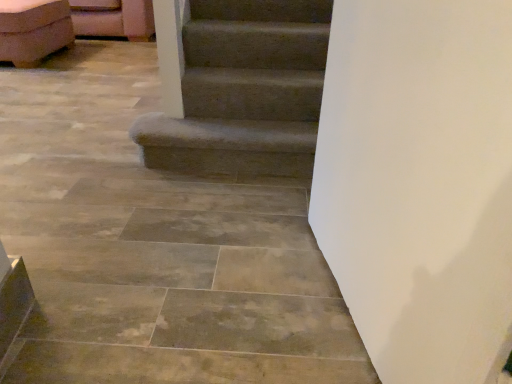
Measure the distance between velvet brown sofa at upper left and camera.

velvet brown sofa at upper left is 2.98 meters from camera.

The width and height of the screenshot is (512, 384). Describe the element at coordinates (33, 30) in the screenshot. I see `velvet brown sofa at upper left` at that location.

Locate an element on the screen. The width and height of the screenshot is (512, 384). velvet brown sofa at upper left is located at coordinates (33, 30).

Locate an element on the screen. velvet brown sofa at upper left is located at coordinates (33, 30).